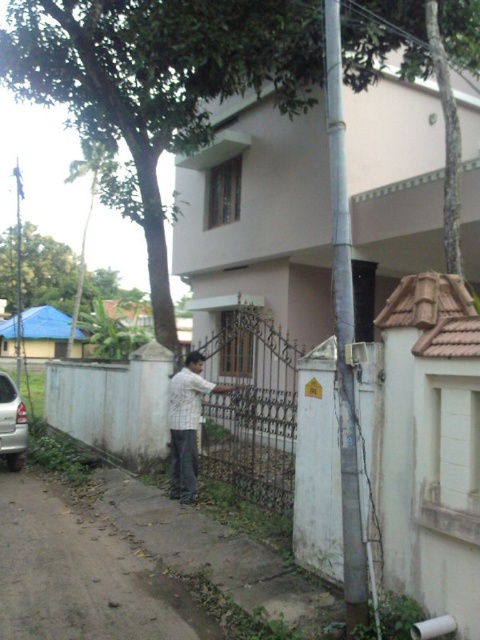
Question: Is white painted metal fence at center to the left of black wrought iron gate at center from the viewer's perspective?

Choices:
 (A) no
 (B) yes

Answer: (B)

Question: Is green leafy tree at upper left behind dirt road at lower left?

Choices:
 (A) no
 (B) yes

Answer: (B)

Question: Which point is farther to the camera?

Choices:
 (A) (248, 460)
 (B) (109, 195)

Answer: (B)

Question: Considering the relative positions of green leafy tree at upper left and black wrought iron gate at center in the image provided, where is green leafy tree at upper left located with respect to black wrought iron gate at center?

Choices:
 (A) above
 (B) below

Answer: (A)

Question: Which object is the closest to the dirt road at lower left?

Choices:
 (A) striped shirt at center
 (B) white painted metal fence at center

Answer: (A)

Question: Which point appears farthest from the camera in this image?

Choices:
 (A) (205, 456)
 (B) (1, 388)

Answer: (B)